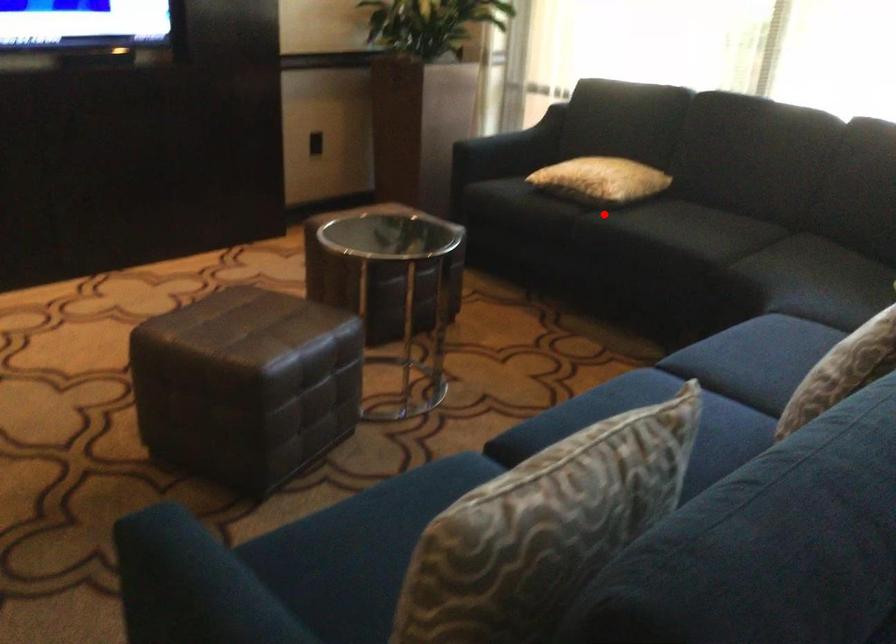
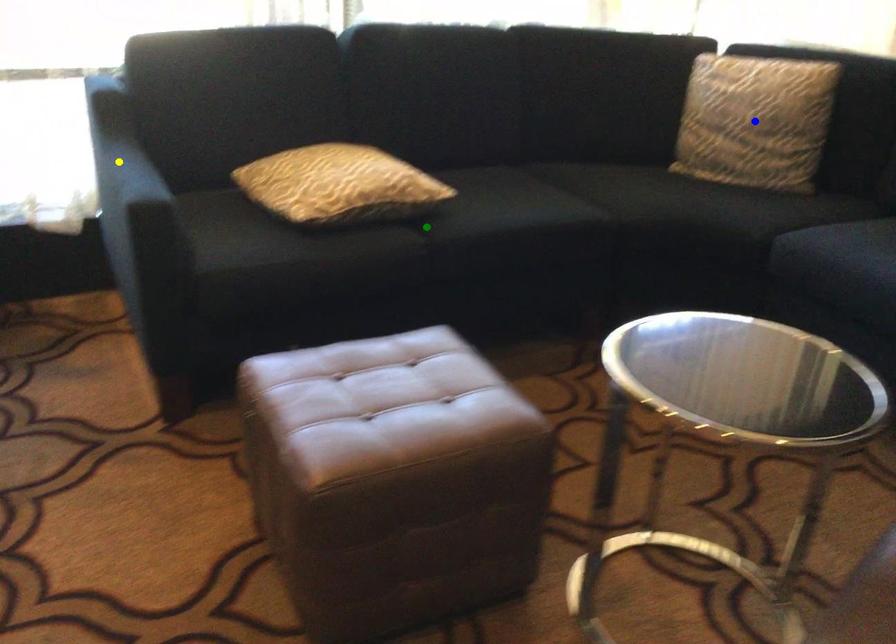
Question: I am providing you with two images of the same scene from different viewpoints. A red point is marked on the first image. You are given multiple points on the second image. Which mark in image 2 goes with the point in image 1?

Choices:
 (A) blue point
 (B) green point
 (C) yellow point

Answer: (B)